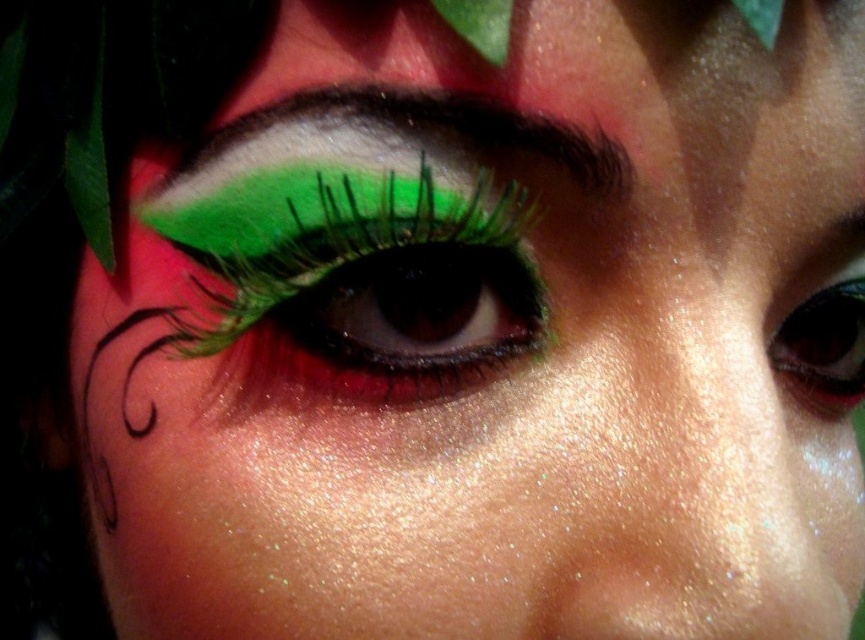
Is dark brown eyebrow at upper center shorter than shiny black eye at center?

Yes, dark brown eyebrow at upper center is shorter than shiny black eye at center.

Can you confirm if dark brown eyebrow at upper center is wider than shiny black eye at center?

Indeed, dark brown eyebrow at upper center has a greater width compared to shiny black eye at center.

Which is behind, point (552, 125) or point (851, 268)?

The point (851, 268) is more distant.

Locate an element on the screen. Image resolution: width=865 pixels, height=640 pixels. dark brown eyebrow at upper center is located at coordinates pos(436,124).

Does green matte eyeliner at center have a smaller size compared to shiny black eye at center?

No.

The width and height of the screenshot is (865, 640). Describe the element at coordinates (372, 269) in the screenshot. I see `green matte eyeliner at center` at that location.

I want to click on green matte eyeliner at center, so click(372, 269).

The image size is (865, 640). What are the coordinates of `green matte eyeliner at center` in the screenshot? It's located at (372, 269).

Can you confirm if green matte eyeliner at center is shorter than dark brown eyebrow at upper center?

In fact, green matte eyeliner at center may be taller than dark brown eyebrow at upper center.

Which of these two, green matte eyeliner at center or dark brown eyebrow at upper center, stands taller?

Standing taller between the two is green matte eyeliner at center.

Locate an element on the screen. The width and height of the screenshot is (865, 640). green matte eyeliner at center is located at coordinates (372, 269).